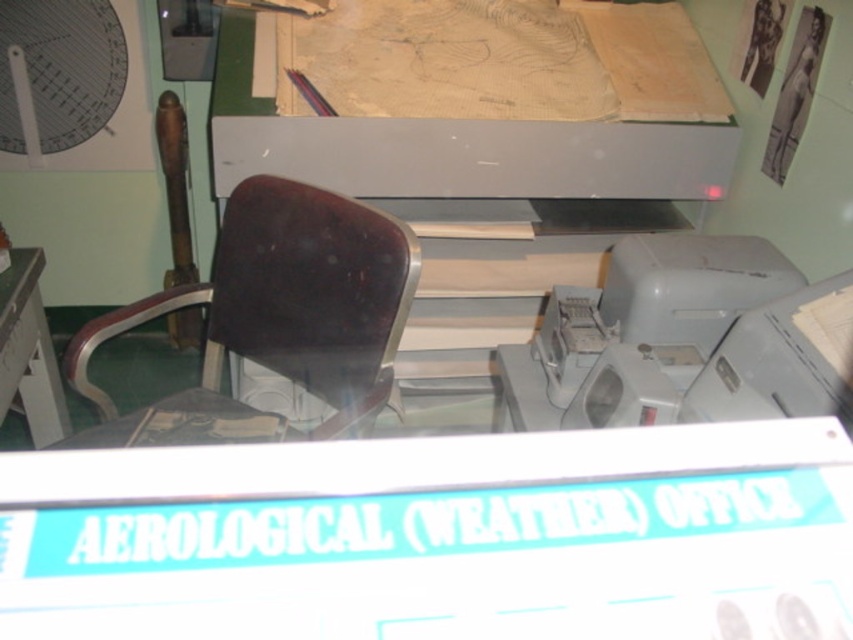
Question: Does matte white mechanical fan at upper left have a lesser width compared to white plastic table at left?

Choices:
 (A) yes
 (B) no

Answer: (B)

Question: Which point is closer to the camera?

Choices:
 (A) (62, 397)
 (B) (106, 406)

Answer: (B)

Question: Does matte white mechanical fan at upper left have a larger size compared to white plastic table at left?

Choices:
 (A) no
 (B) yes

Answer: (A)

Question: Which of the following is the closest to the observer?

Choices:
 (A) (73, 83)
 (B) (221, 422)
 (C) (44, 396)

Answer: (B)

Question: Which point is farther to the camera?

Choices:
 (A) (143, 412)
 (B) (33, 340)

Answer: (B)

Question: Is matte white mechanical fan at upper left to the right of white plastic table at left from the viewer's perspective?

Choices:
 (A) yes
 (B) no

Answer: (B)